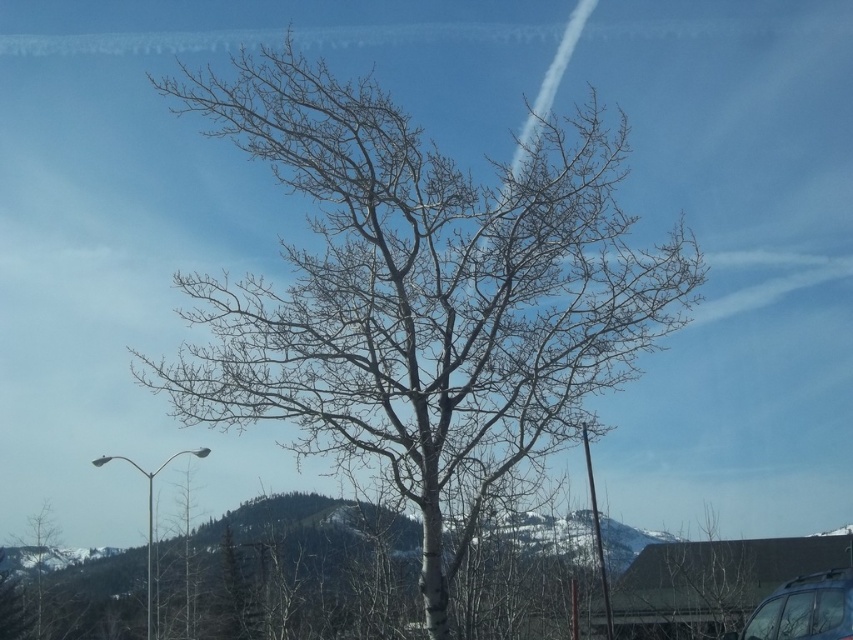
Question: Can you confirm if bare wood tree at center is positioned to the left of transparent glass car window at lower right?

Choices:
 (A) no
 (B) yes

Answer: (B)

Question: Does metallic blue car at lower right have a greater width compared to transparent glass car window at lower right?

Choices:
 (A) no
 (B) yes

Answer: (B)

Question: Which point is closer to the camera?

Choices:
 (A) bare wood tree at center
 (B) metallic blue car at lower right

Answer: (A)

Question: Which object is farther from the camera taking this photo?

Choices:
 (A) metallic blue car at lower right
 (B) transparent glass car window at center
 (C) transparent glass car window at lower right

Answer: (C)

Question: Estimate the real-world distances between objects in this image. Which object is farther from the metallic blue car at lower right?

Choices:
 (A) bare wood tree at lower left
 (B) transparent glass car window at lower right
 (C) transparent glass car window at center
 (D) bare wood tree at center

Answer: (A)

Question: Can you confirm if metallic blue car at lower right is thinner than transparent glass car window at center?

Choices:
 (A) no
 (B) yes

Answer: (A)